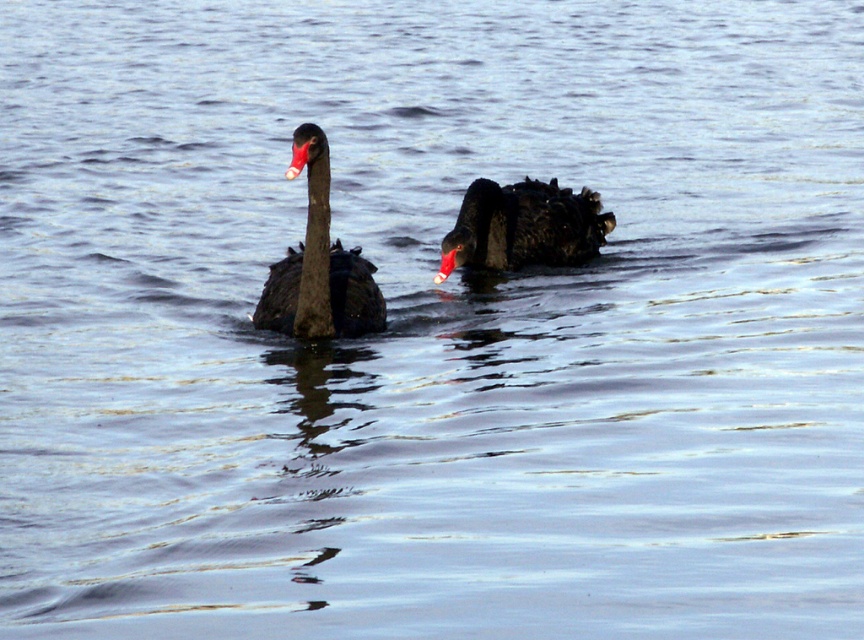
Question: Can you confirm if matte black swan at left is positioned to the right of shiny black swan at center?

Choices:
 (A) yes
 (B) no

Answer: (B)

Question: Does matte black swan at left come in front of shiny black swan at center?

Choices:
 (A) yes
 (B) no

Answer: (A)

Question: Which point is closer to the camera?

Choices:
 (A) shiny black swan at center
 (B) matte black swan at left

Answer: (B)

Question: Is matte black swan at left smaller than shiny black swan at center?

Choices:
 (A) yes
 (B) no

Answer: (B)

Question: Which point is closer to the camera taking this photo?

Choices:
 (A) (302, 324)
 (B) (561, 230)

Answer: (A)